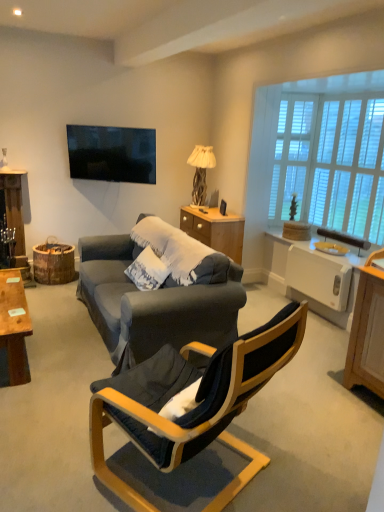
Question: Is velvet dark blue chair at center turned away from white wooden window at upper right, which is the 1th window in left-to-right order?

Choices:
 (A) yes
 (B) no

Answer: (B)

Question: Is velvet dark blue chair at center to the left of white wooden window at upper right, the 2th window in the right-to-left sequence, from the viewer's perspective?

Choices:
 (A) no
 (B) yes

Answer: (B)

Question: Does velvet dark blue chair at center appear on the right side of white wooden window at upper right, which is the 1th window in left-to-right order?

Choices:
 (A) yes
 (B) no

Answer: (B)

Question: From a real-world perspective, is velvet dark blue chair at center below white wooden window at upper right, which is the 1th window in left-to-right order?

Choices:
 (A) yes
 (B) no

Answer: (A)

Question: Is velvet dark blue chair at center positioned beyond the bounds of white wooden window at upper right, which is the 1th window in left-to-right order?

Choices:
 (A) yes
 (B) no

Answer: (A)

Question: Looking at the image, does woodenmaterial/texturedresser at center seem bigger or smaller compared to wooden textured lamp at center?

Choices:
 (A) small
 (B) big

Answer: (B)

Question: From a real-world perspective, is woodenmaterial/texturedresser at center positioned above or below wooden textured lamp at center?

Choices:
 (A) above
 (B) below

Answer: (B)

Question: In terms of width, does woodenmaterial/texturedresser at center look wider or thinner when compared to wooden textured lamp at center?

Choices:
 (A) wide
 (B) thin

Answer: (A)

Question: Is point (216, 231) closer or farther from the camera than point (203, 164)?

Choices:
 (A) closer
 (B) farther

Answer: (A)

Question: Do you think woodenmaterial/texturedresser at center is within white textured pillow at center, or outside of it?

Choices:
 (A) outside
 (B) inside

Answer: (A)

Question: From a real-world perspective, is woodenmaterial/texturedresser at center physically located above or below white textured pillow at center?

Choices:
 (A) below
 (B) above

Answer: (A)

Question: Is woodenmaterial/texturedresser at center wider or thinner than white textured pillow at center?

Choices:
 (A) thin
 (B) wide

Answer: (B)

Question: Considering the relative positions of woodenmaterial/texturedresser at center and white textured pillow at center in the image provided, is woodenmaterial/texturedresser at center to the left or to the right of white textured pillow at center?

Choices:
 (A) right
 (B) left

Answer: (A)

Question: Is white textured pillow at center taller or shorter than white wooden window at upper right, which is the 1th window in left-to-right order?

Choices:
 (A) tall
 (B) short

Answer: (B)

Question: Does point (145, 283) appear closer or farther from the camera than point (278, 144)?

Choices:
 (A) farther
 (B) closer

Answer: (B)